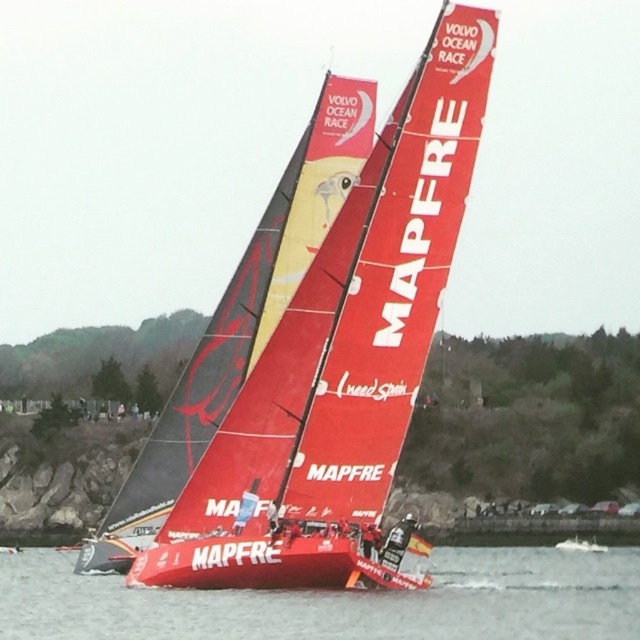
You are a photographer positioned at the camera. You want to capture a closeup shot of the point at coordinates (410, 600). Given that you are 200.79 feet away from that point, do you think you can get a clear closeup without moving closer?

The point at coordinates (410, 600) is 200.79 feet away from the camera. Depending on the zoom capability of your camera, you might be able to capture a clear closeup without moving closer. However, if your equipment has sufficient zoom, it should be possible.

You are a photographer positioned on the shore observing the two boats in the Volvo Ocean Race. You want to capture a photo where the red plastic water at lower center is to the right of the red matte sailboat at center. Is this possible based on the current arrangement?

Yes, the red plastic water at lower center is already positioned to the right of the red matte sailboat at center, so capturing such a photo is possible.